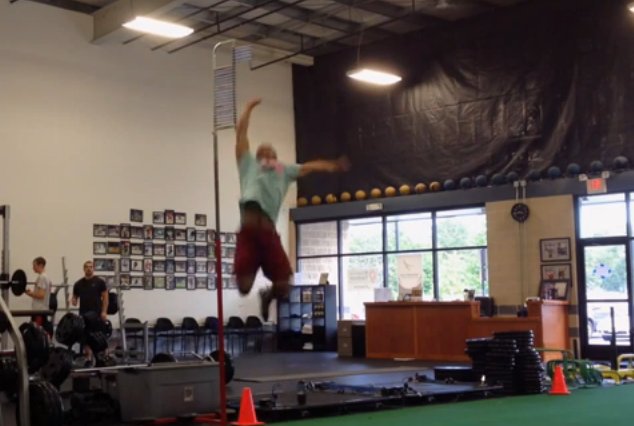
Locate an element on the screen. glass window, black borders is located at coordinates (370, 246).